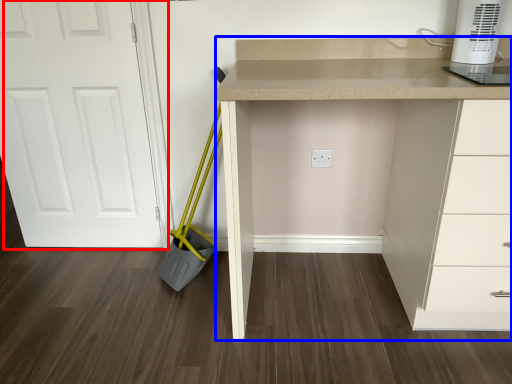
Question: Which point is further to the camera, door (highlighted by a red box) or computer desk (highlighted by a blue box)?

Choices:
 (A) door
 (B) computer desk

Answer: (A)